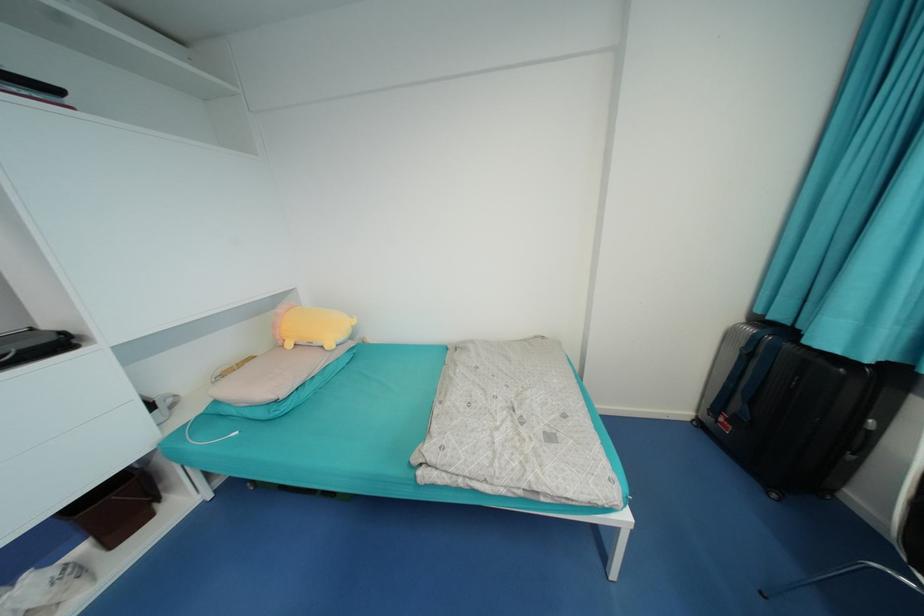
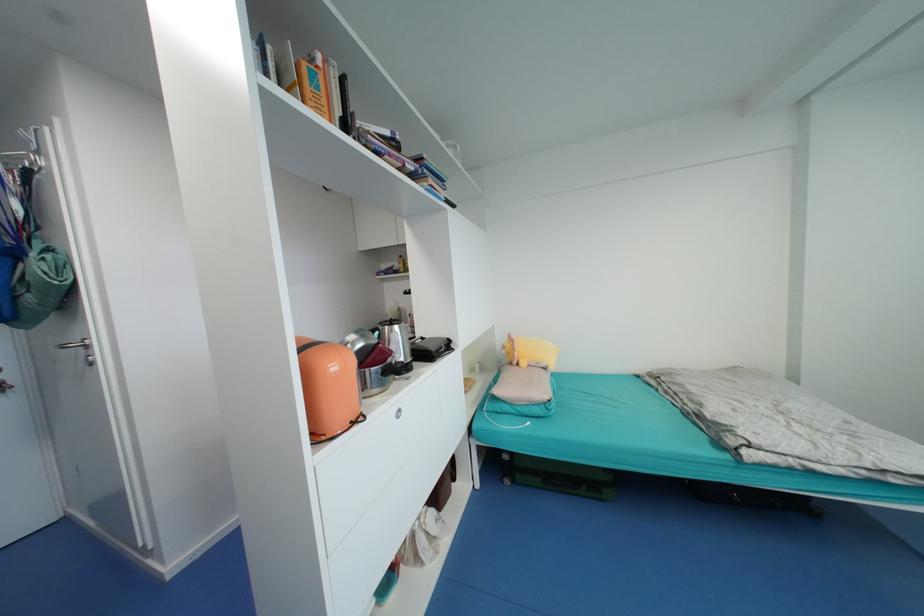
Locate, in the second image, the point that corresponds to (x=294, y=346) in the first image.

(529, 365)